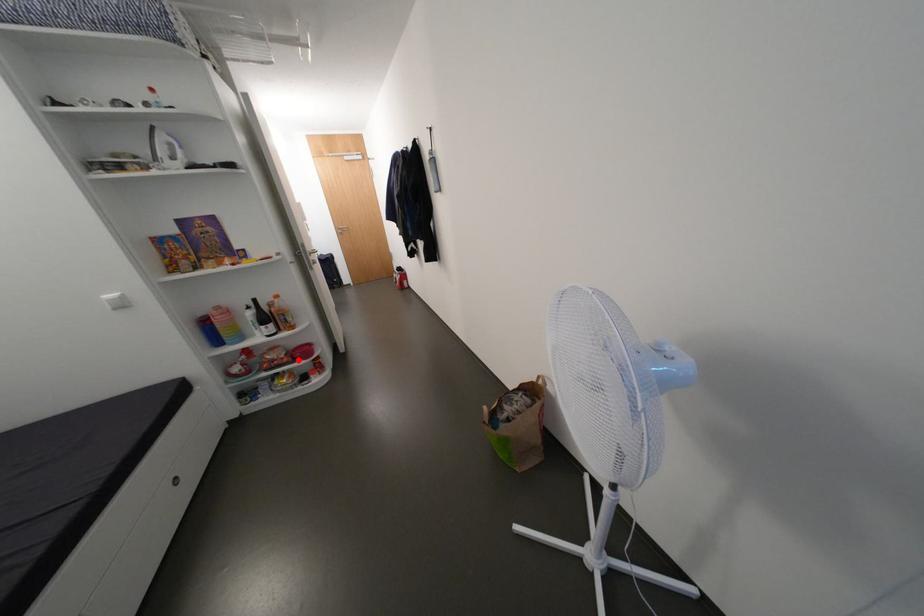
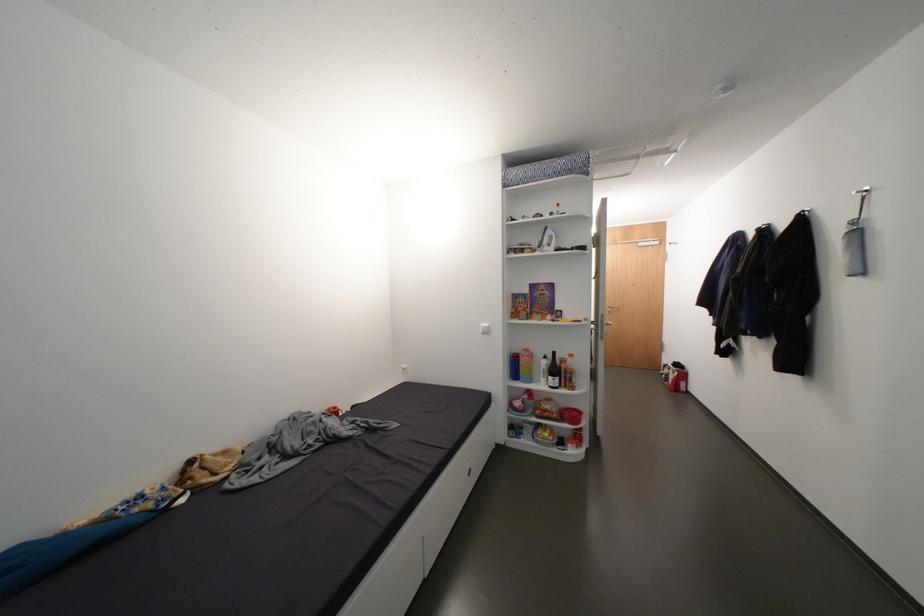
Question: I am providing you with two images of the same scene from different viewpoints. Image1 has a red point marked. In image2, the corresponding 3D location appears at what relative position? Reply with the corresponding letter.

Choices:
 (A) Closer
 (B) Farther

Answer: (B)